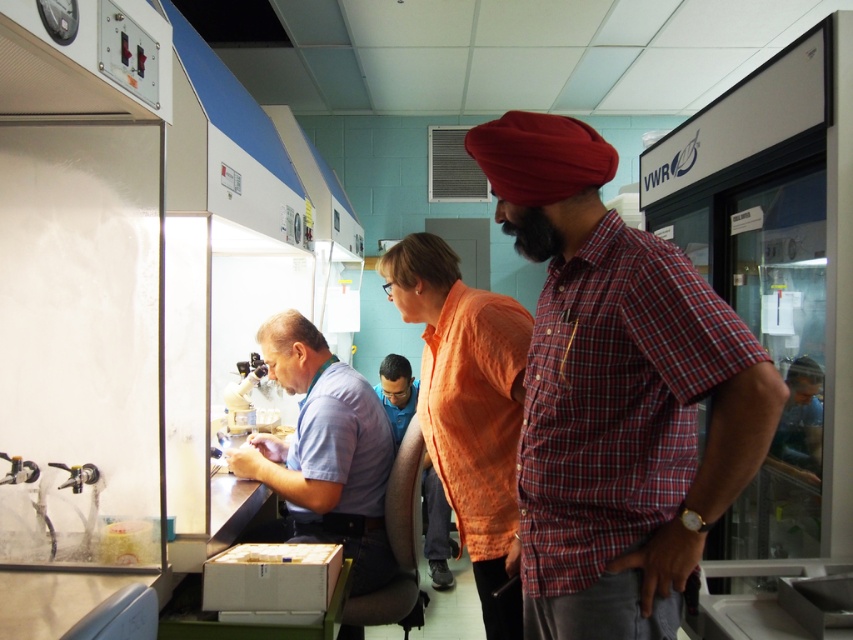
Is red plaid shirt at center thinner than light blue shirt at center?

Yes.

Which is more to the left, red plaid shirt at center or light blue shirt at center?

From the viewer's perspective, light blue shirt at center appears more on the left side.

This screenshot has height=640, width=853. What are the coordinates of `red plaid shirt at center` in the screenshot? It's located at (616, 394).

Where is `red plaid shirt at center`? This screenshot has width=853, height=640. red plaid shirt at center is located at coordinates (616, 394).

Between red plaid shirt at center and orange fabric shirt at center, which one is positioned lower?

orange fabric shirt at center

Is red plaid shirt at center taller than orange fabric shirt at center?

No.

This screenshot has height=640, width=853. I want to click on red plaid shirt at center, so click(x=616, y=394).

Which is below, orange fabric shirt at center or blue fabric shirt at center?

blue fabric shirt at center

Which is above, orange fabric shirt at center or blue fabric shirt at center?

orange fabric shirt at center is above.

Does point (491, 440) come in front of point (432, 564)?

That is True.

Locate an element on the screen. orange fabric shirt at center is located at coordinates (468, 404).